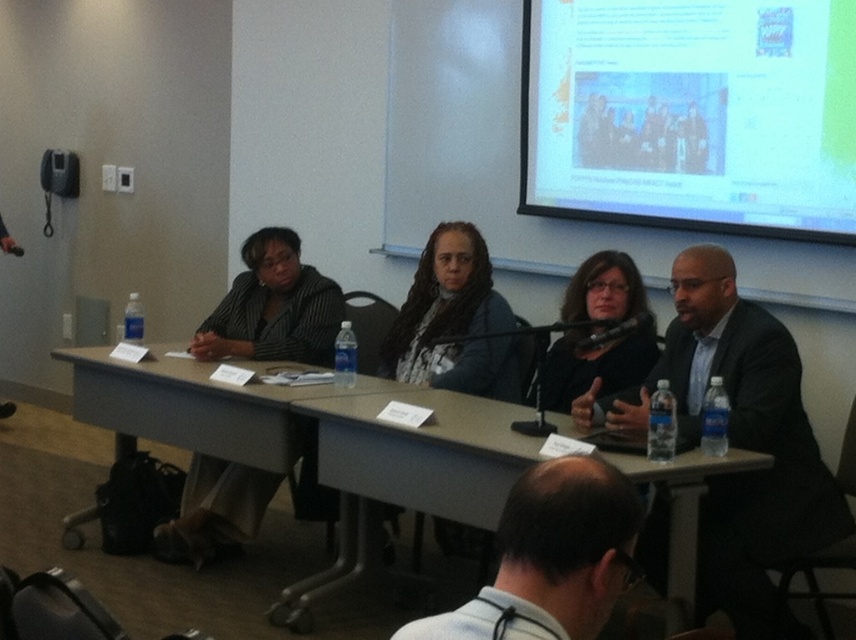
Question: Is black suit at center smaller than black matte jacket at center?

Choices:
 (A) yes
 (B) no

Answer: (B)

Question: Which of the following is the closest to the observer?

Choices:
 (A) black suit at center
 (B) gray/wooden table at center
 (C) striped fabric jacket at center

Answer: (A)

Question: In this image, where is black suit at center located relative to gray/wooden table at center?

Choices:
 (A) left
 (B) right

Answer: (B)

Question: Which object is the farthest from the black suit at center?

Choices:
 (A) light brown wood table at center
 (B) white glossy projector screen at upper right
 (C) black matte jacket at center
 (D) striped fabric jacket at center

Answer: (D)

Question: Can you confirm if white glossy projector screen at upper right is positioned above light blue shirt at lower center?

Choices:
 (A) no
 (B) yes

Answer: (B)

Question: Which of the following is the farthest from the observer?

Choices:
 (A) (248, 490)
 (B) (620, 577)
 (C) (528, 99)
 (D) (509, 486)

Answer: (C)